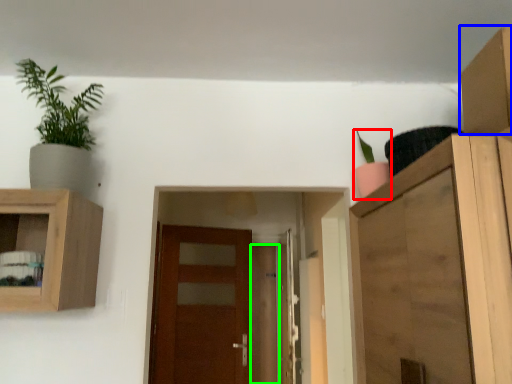
Question: Estimate the real-world distances between objects in this image. Which object is farther from houseplant (highlighted by a red box), cardboard box (highlighted by a blue box) or door (highlighted by a green box)?

Choices:
 (A) cardboard box
 (B) door

Answer: (B)